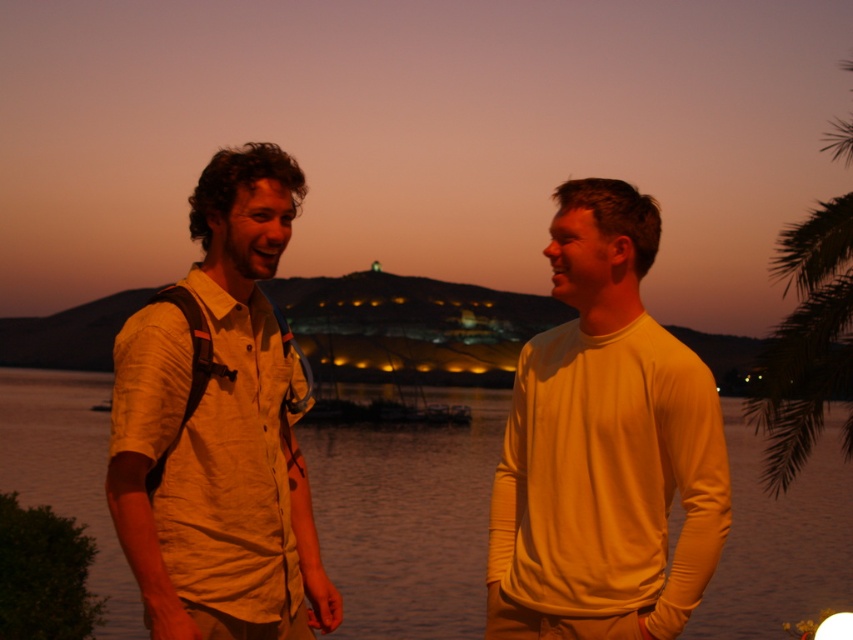
Is matte yellow water at center above beige cotton shirt at left?

Incorrect, matte yellow water at center is not positioned above beige cotton shirt at left.

Between point (432, 544) and point (242, 515), which one is positioned behind?

The point (432, 544) is behind.

This screenshot has width=853, height=640. Find the location of `matte yellow water at center`. matte yellow water at center is located at coordinates (407, 518).

What are the coordinates of `matte yellow water at center` in the screenshot? It's located at (407, 518).

Does point (200, 600) lie in front of point (788, 595)?

Yes, point (200, 600) is closer to viewer.

Can you confirm if beige cotton shirt at center is wider than matte yellow water at center?

In fact, beige cotton shirt at center might be narrower than matte yellow water at center.

Does point (282, 541) lie in front of point (753, 472)?

Yes, it is in front of point (753, 472).

Where is `beige cotton shirt at center`? This screenshot has height=640, width=853. beige cotton shirt at center is located at coordinates (219, 429).

Can you confirm if beige cotton shirt at center is thinner than green leafy palm tree at right?

Correct, beige cotton shirt at center's width is less than green leafy palm tree at right's.

Who is higher up, beige cotton shirt at center or green leafy palm tree at right?

green leafy palm tree at right

Does point (691, 524) lie behind point (821, 426)?

No.

Where is `beige cotton shirt at center`? This screenshot has height=640, width=853. beige cotton shirt at center is located at coordinates (219, 429).